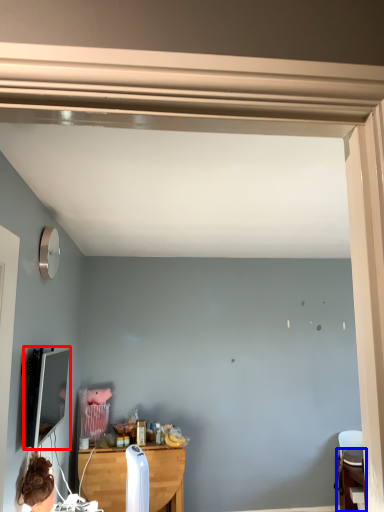
Question: Which point is further to the camera, computer monitor (highlighted by a red box) or table (highlighted by a blue box)?

Choices:
 (A) computer monitor
 (B) table

Answer: (B)